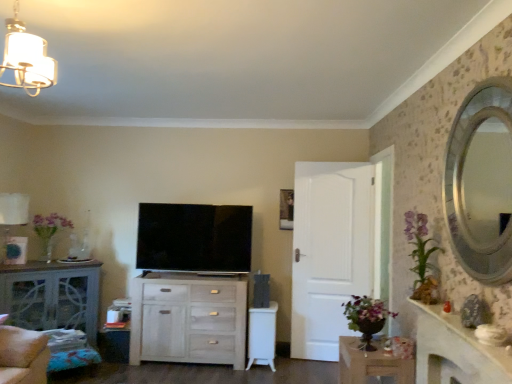
Question: Considering the relative sizes of wooden table at lower right, which appears as the 2th table when viewed from the back, and flat screen tv at center in the image provided, is wooden table at lower right, which appears as the 2th table when viewed from the back, bigger than flat screen tv at center?

Choices:
 (A) yes
 (B) no

Answer: (B)

Question: Is wooden table at lower right, marked as the first table in a right-to-left arrangement, completely or partially outside of flat screen tv at center?

Choices:
 (A) yes
 (B) no

Answer: (A)

Question: Is flat screen tv at center inside wooden table at lower right, which is the 2th table from left to right?

Choices:
 (A) yes
 (B) no

Answer: (B)

Question: Is wooden table at lower right, which is the 2th table from left to right, shorter than flat screen tv at center?

Choices:
 (A) yes
 (B) no

Answer: (A)

Question: Are wooden table at lower right, which appears as the 2th table when viewed from the back, and flat screen tv at center making contact?

Choices:
 (A) yes
 (B) no

Answer: (B)

Question: From the image's perspective, is wooden table at lower right, which appears as the 2th table when viewed from the back, located above flat screen tv at center?

Choices:
 (A) yes
 (B) no

Answer: (B)

Question: Are matte gray cabinet at left, the first table when ordered from back to front, and white marble fireplace at right located far from each other?

Choices:
 (A) no
 (B) yes

Answer: (B)

Question: From the image's perspective, is matte gray cabinet at left, which ranks as the 1th table in left-to-right order, below white marble fireplace at right?

Choices:
 (A) no
 (B) yes

Answer: (B)

Question: From the image's perspective, is matte gray cabinet at left, the first table when ordered from back to front, above white marble fireplace at right?

Choices:
 (A) no
 (B) yes

Answer: (A)

Question: Is matte gray cabinet at left, acting as the 2th table starting from the front, at the left side of white marble fireplace at right?

Choices:
 (A) yes
 (B) no

Answer: (A)

Question: Considering the relative sizes of matte gray cabinet at left, which ranks as the 1th table in left-to-right order, and white marble fireplace at right in the image provided, is matte gray cabinet at left, which ranks as the 1th table in left-to-right order, bigger than white marble fireplace at right?

Choices:
 (A) no
 (B) yes

Answer: (B)

Question: Is matte gray cabinet at left, which ranks as the 1th table in left-to-right order, outside of white marble fireplace at right?

Choices:
 (A) no
 (B) yes

Answer: (B)

Question: Could you tell me if white matte door at center is turned towards white marble fireplace at right?

Choices:
 (A) yes
 (B) no

Answer: (A)